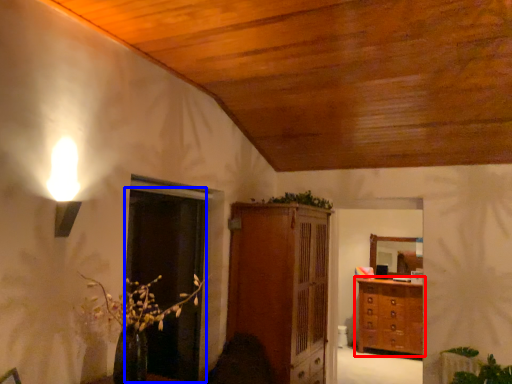
Question: Among these objects, which one is nearest to the camera, chest of drawers (highlighted by a red box) or glass door (highlighted by a blue box)?

Choices:
 (A) chest of drawers
 (B) glass door

Answer: (B)